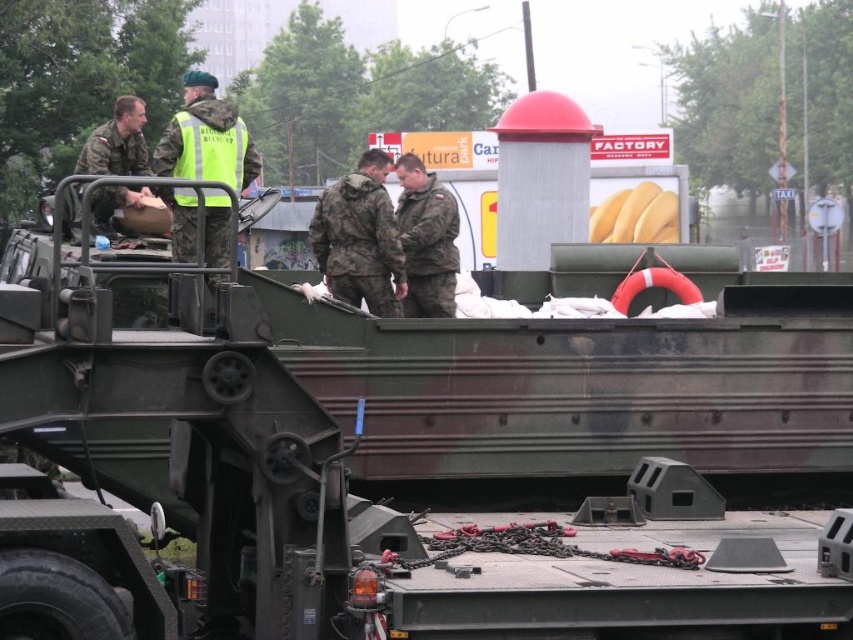
Question: Can you confirm if green reflective vest at upper center is positioned to the right of camouflage uniform at center?

Choices:
 (A) no
 (B) yes

Answer: (A)

Question: Which object is the farthest from the matte green uniform at left?

Choices:
 (A) camouflage uniform at center
 (B) camouflage fabric uniform at center
 (C) green reflective vest at upper center

Answer: (B)

Question: Among these points, which one is nearest to the camera?

Choices:
 (A) (135, 134)
 (B) (206, 145)
 (C) (367, 204)
 (D) (456, 266)

Answer: (C)

Question: In this image, where is camouflage fabric uniform at center located relative to matte green uniform at left?

Choices:
 (A) left
 (B) right

Answer: (B)

Question: Is camouflage fabric uniform at center closer to camera compared to camouflage uniform at center?

Choices:
 (A) no
 (B) yes

Answer: (A)

Question: Estimate the real-world distances between objects in this image. Which object is closer to the camouflage uniform at center?

Choices:
 (A) camouflage fabric uniform at center
 (B) green reflective vest at upper center
 (C) matte green uniform at left

Answer: (A)